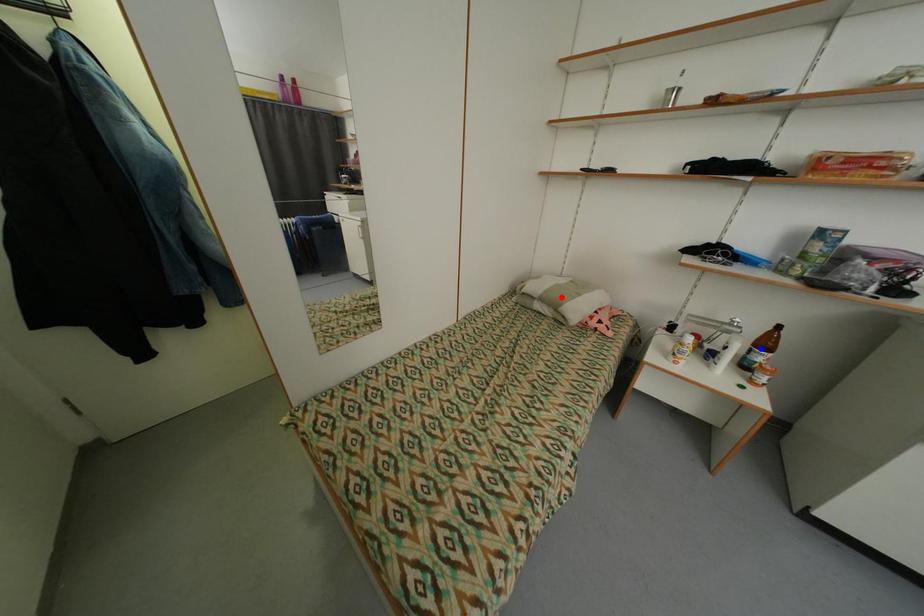
Question: Two points are marked on the image. Which point is closer to the camera?

Choices:
 (A) Blue point is closer.
 (B) Red point is closer.

Answer: (A)